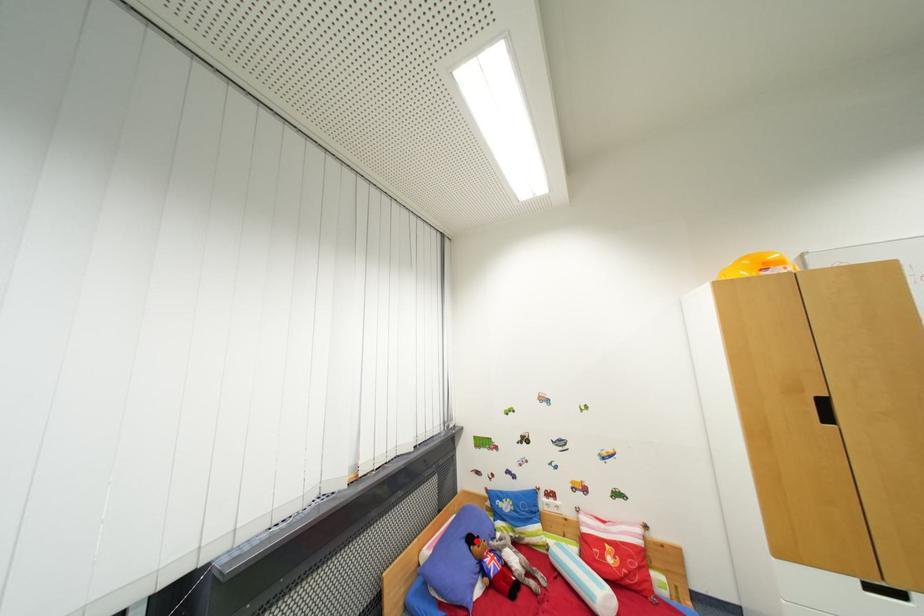
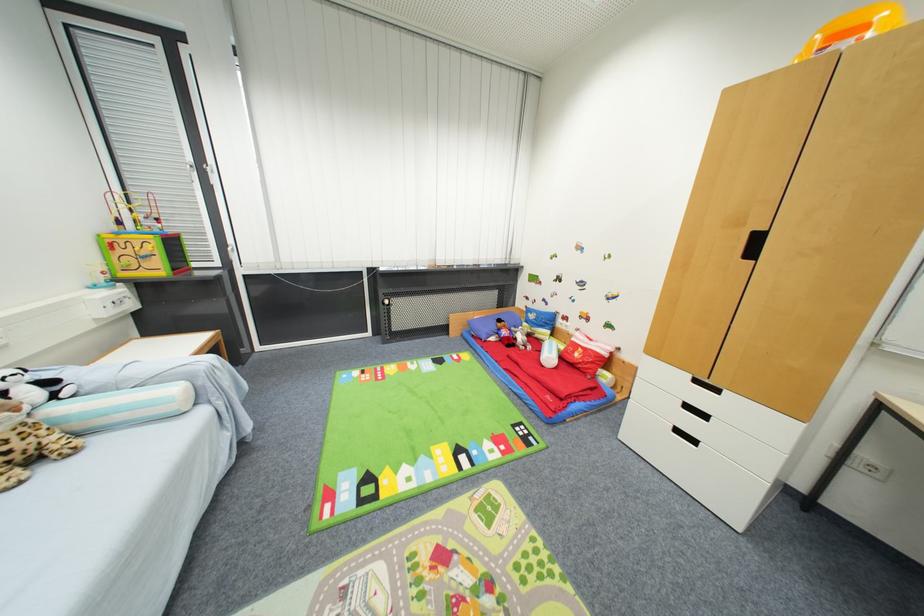
The point at the highlighted location is marked in the first image. Where is the corresponding point in the second image?

(505, 323)